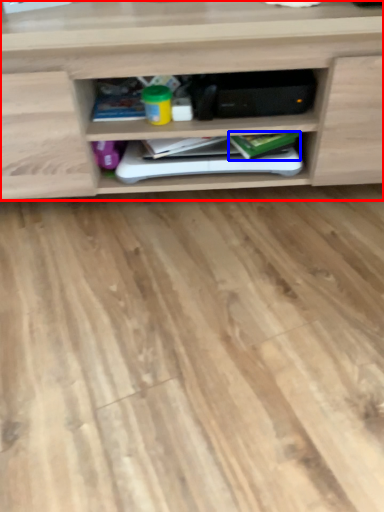
Question: Which object appears closest to the camera in this image, shelf (highlighted by a red box) or book (highlighted by a blue box)?

Choices:
 (A) shelf
 (B) book

Answer: (A)